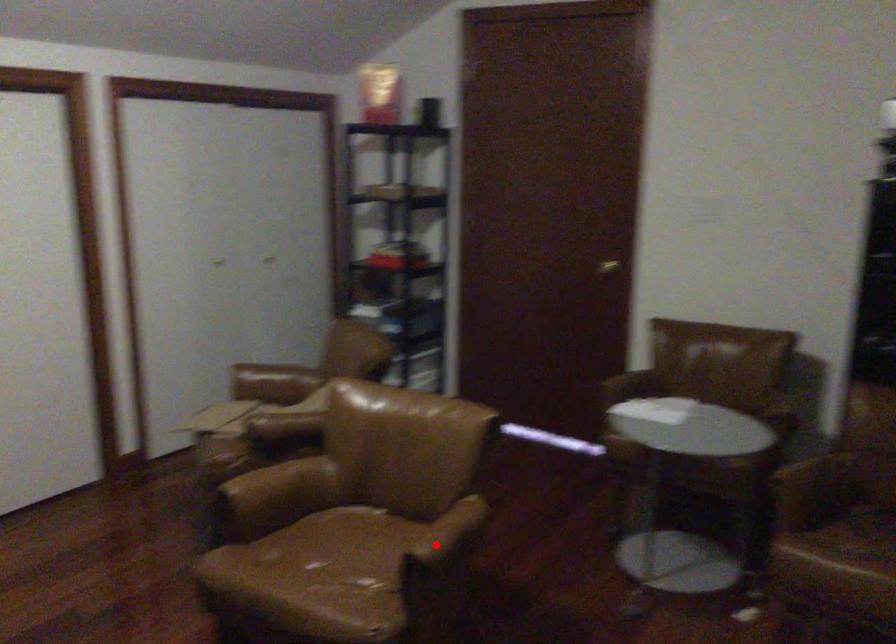
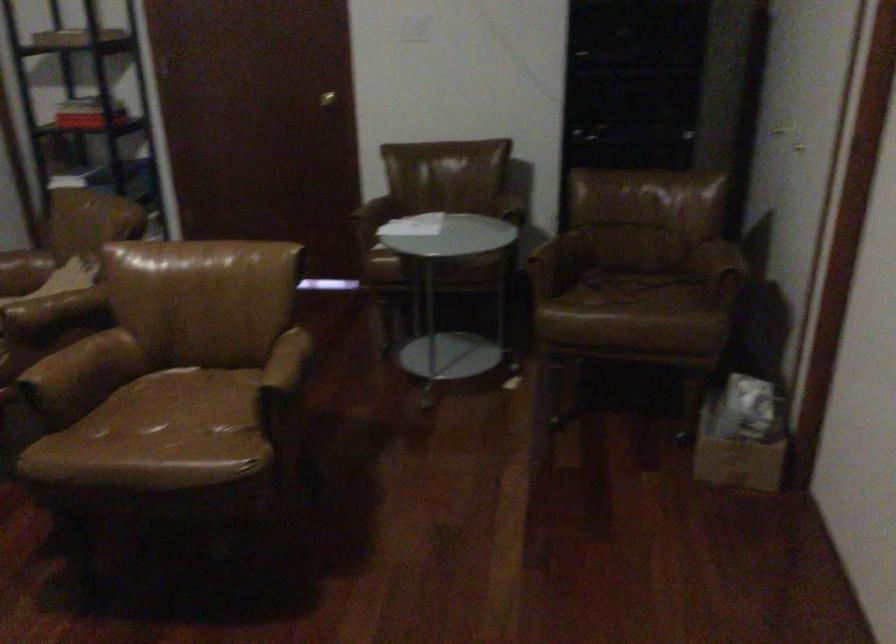
In the second image, find the point that corresponds to the highlighted location in the first image.

(283, 371)